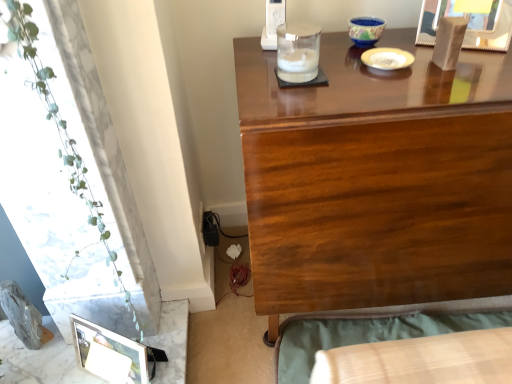
Identify the location of free area in between white glossy plate at upper center and wooden picture frame at upper right, arranged as the 2th picture frame when ordered from the bottom. The height and width of the screenshot is (384, 512). (426, 45).